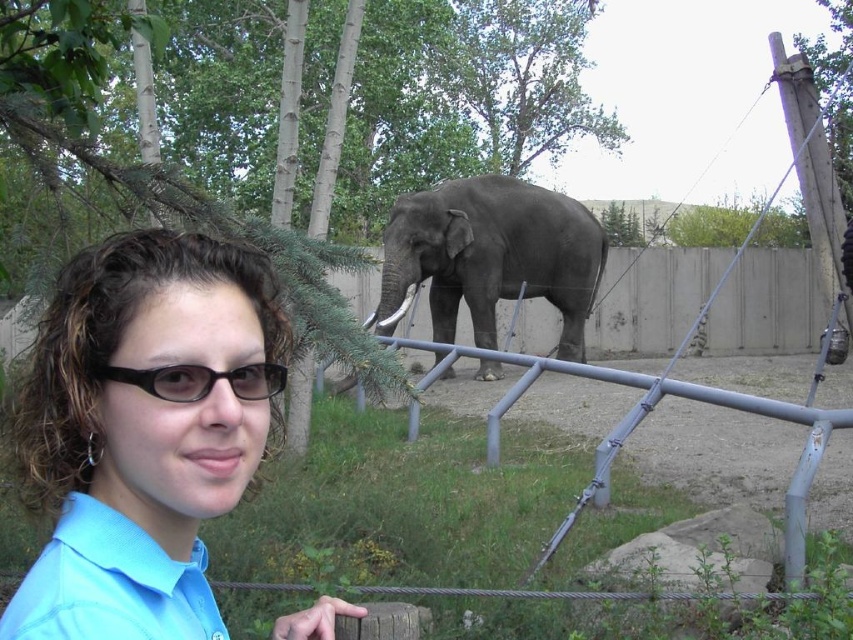
Who is positioned more to the right, blue shirt at center or black plastic glasses at center?

From the viewer's perspective, black plastic glasses at center appears more on the right side.

How much distance is there between blue shirt at center and black plastic glasses at center?

blue shirt at center is 5.55 inches away from black plastic glasses at center.

The height and width of the screenshot is (640, 853). I want to click on blue shirt at center, so click(x=143, y=429).

Does gray matte elephant at center appear on the right side of light blue fabric shirt at lower left?

Correct, you'll find gray matte elephant at center to the right of light blue fabric shirt at lower left.

Does gray matte elephant at center have a smaller size compared to light blue fabric shirt at lower left?

No, gray matte elephant at center is not smaller than light blue fabric shirt at lower left.

Does point (445, 294) lie behind point (216, 632)?

That is True.

Where is `gray matte elephant at center`? This screenshot has width=853, height=640. gray matte elephant at center is located at coordinates (492, 253).

Is point (213, 483) farther from viewer compared to point (200, 628)?

No.

Does blue shirt at center appear on the left side of light blue fabric shirt at lower left?

Incorrect, blue shirt at center is not on the left side of light blue fabric shirt at lower left.

Does point (24, 416) come farther from viewer compared to point (85, 636)?

Yes, it is behind point (85, 636).

The height and width of the screenshot is (640, 853). What are the coordinates of `blue shirt at center` in the screenshot? It's located at (143, 429).